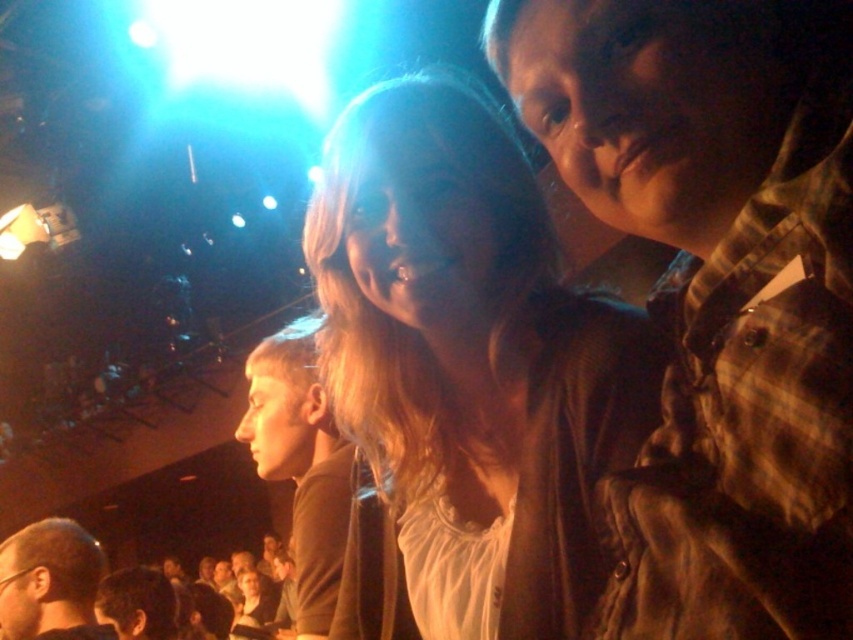
You are a photographer at the concert venue and need to capture a wide shot that includes both the brown plaid shirt at upper right and the light brown hair at lower left. Based on their sizes in the image, which object would require you to zoom out more to ensure it fits into the frame?

The light brown hair at lower left requires zooming out more because it has a greater width than the brown plaid shirt at upper right, necessitating a wider frame to accommodate its size.

You are standing at the back of the concert venue and want to take a photo of the light brown hair at center and the brown matte shirt at center. Which one will appear larger in your photo?

The light brown hair at center will appear larger in the photo because it is closer to the viewer than the brown matte shirt at center.

You are at a concert venue and see two people in the foreground. One is wearing a brown plaid shirt at upper right and the other a brown matte shirt at center. Which person is positioned higher in the image?

The brown plaid shirt at upper right is positioned higher in the image than the brown matte shirt at center.